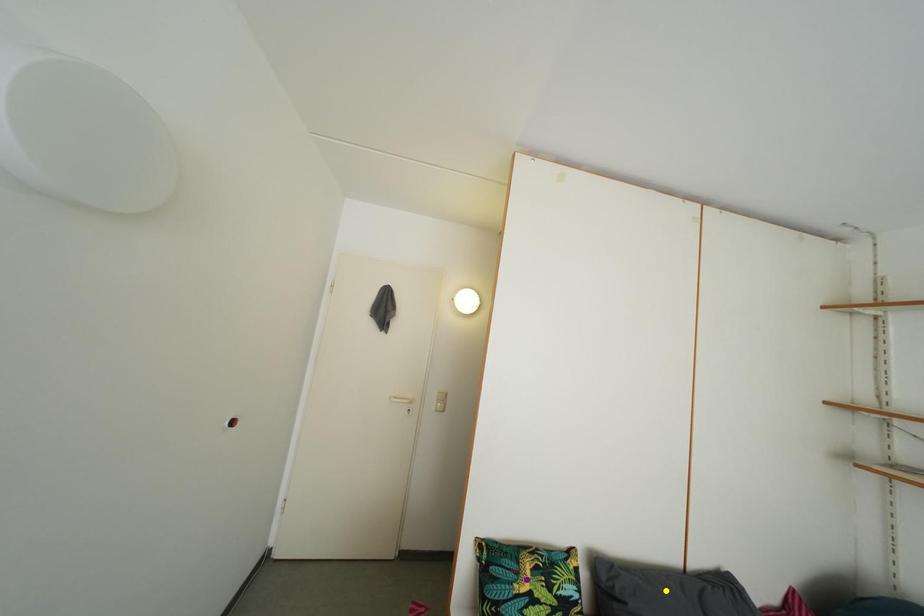
Order these from nearest to farthest:
A) orange point
B) purple point
C) yellow point

purple point < orange point < yellow point